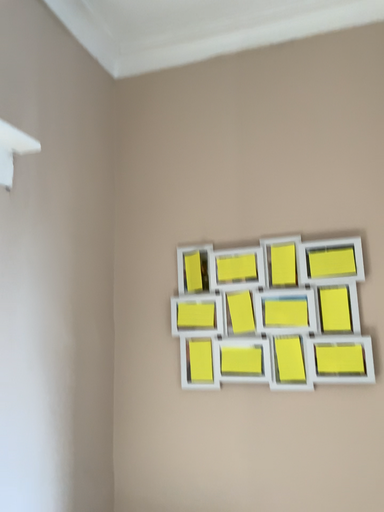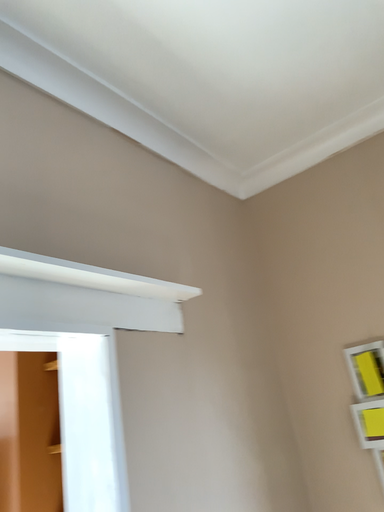
Question: How did the camera likely rotate when shooting the video?

Choices:
 (A) rotated downward
 (B) rotated upward

Answer: (B)